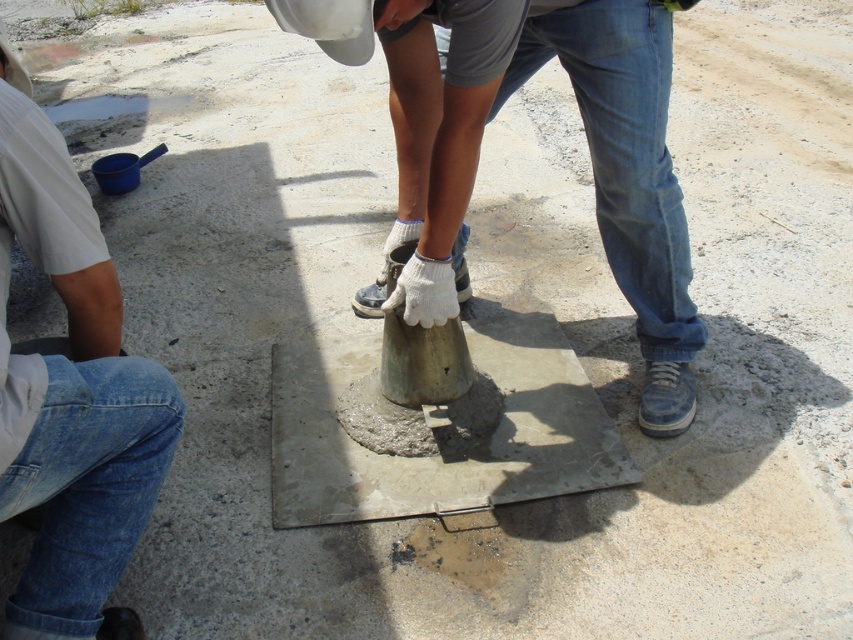
Who is lower down, metallic gray cone at center or denim jeans at left?

denim jeans at left is lower down.

Describe the element at coordinates (589, 147) in the screenshot. I see `metallic gray cone at center` at that location.

Where is `metallic gray cone at center`? metallic gray cone at center is located at coordinates (589, 147).